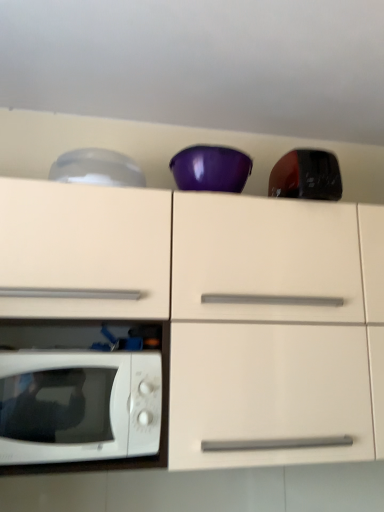
Question: Considering the positions of point (296, 177) and point (69, 173), is point (296, 177) closer or farther from the camera than point (69, 173)?

Choices:
 (A) farther
 (B) closer

Answer: (A)

Question: In the image, is glossy black toaster at upper right, arranged as the first appliance when viewed from the right, on the left side or the right side of transparent plastic bowl at upper left, positioned as the 1th appliance in left-to-right order?

Choices:
 (A) right
 (B) left

Answer: (A)

Question: Estimate the real-world distances between objects in this image. Which object is closer to the white glossy microwave oven at lower left?

Choices:
 (A) transparent plastic bowl at upper left, the 2th appliance viewed from the right
 (B) white glossy cabinet at center
 (C) glossy black toaster at upper right, arranged as the first appliance when viewed from the right

Answer: (B)

Question: Which is nearer to the glossy black toaster at upper right, arranged as the 2th appliance when viewed from the left?

Choices:
 (A) white glossy microwave oven at lower left
 (B) transparent plastic bowl at upper left, positioned as the 1th appliance in left-to-right order
 (C) white glossy cabinet at center

Answer: (C)